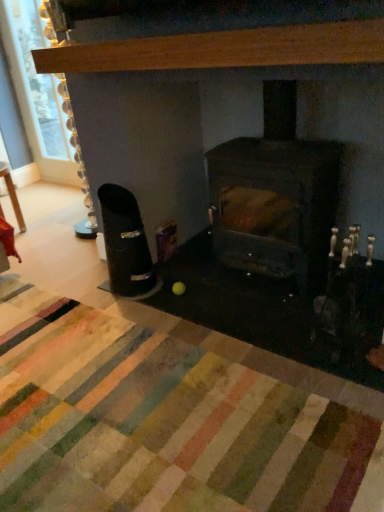
Question: Considering the positions of clear glass window screen at upper left and light brown wood mantel at upper center in the image, is clear glass window screen at upper left bigger or smaller than light brown wood mantel at upper center?

Choices:
 (A) big
 (B) small

Answer: (A)

Question: From the image's perspective, is clear glass window screen at upper left positioned above or below light brown wood mantel at upper center?

Choices:
 (A) above
 (B) below

Answer: (A)

Question: Which object is the farthest from the dark brown wood burning stove at center?

Choices:
 (A) light brown wood mantel at upper center
 (B) black plastic ashtray at left
 (C) wooden table at left
 (D) multicolored rug at center
 (E) clear glass window screen at upper left

Answer: (E)

Question: Which object is positioned closest to the multicolored rug at center?

Choices:
 (A) clear glass window screen at upper left
 (B) dark brown wood burning stove at center
 (C) light brown wood mantel at upper center
 (D) black plastic ashtray at left
 (E) wooden table at left

Answer: (D)